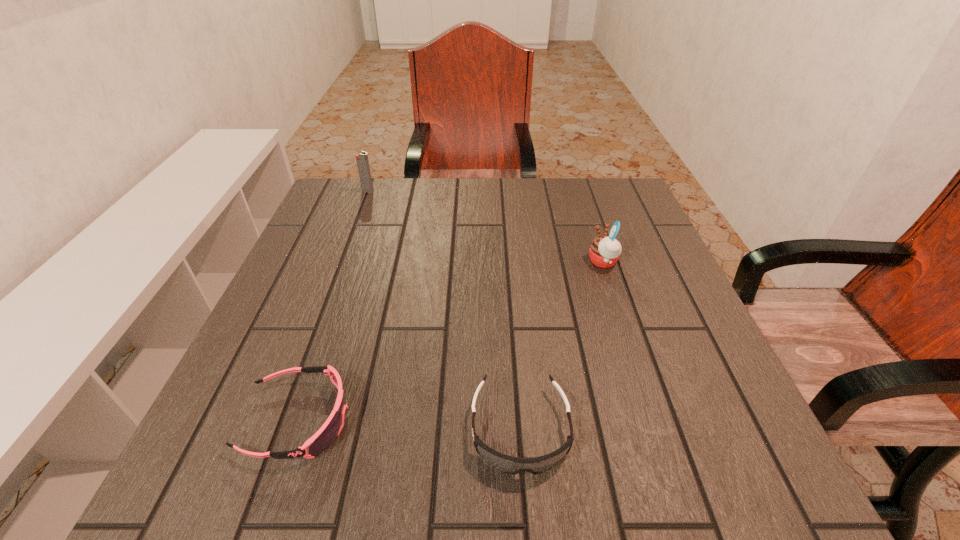
Locate an element on the screen. Image resolution: width=960 pixels, height=540 pixels. free space that is in between the left goggles and the igniter is located at coordinates (333, 305).

This screenshot has width=960, height=540. Find the location of `free point between the muffin and the left goggles`. free point between the muffin and the left goggles is located at coordinates (450, 341).

What are the coordinates of `free space between the second farthest object and the left goggles` in the screenshot? It's located at (450, 341).

This screenshot has width=960, height=540. Identify the location of unoccupied position between the muffin and the left goggles. (450, 341).

Find the location of a particular element. Image resolution: width=960 pixels, height=540 pixels. vacant region between the igniter and the third nearest object is located at coordinates (486, 226).

Locate an element on the screen. This screenshot has height=540, width=960. vacant region between the igniter and the left goggles is located at coordinates (333, 305).

Image resolution: width=960 pixels, height=540 pixels. Identify the location of free point between the right goggles and the igniter. (444, 310).

Locate an element on the screen. blank region between the left goggles and the muffin is located at coordinates (450, 341).

Locate an element on the screen. The image size is (960, 540). free area in between the farthest object and the left goggles is located at coordinates (333, 305).

You are a GUI agent. You are given a task and a screenshot of the screen. Output one action in this format:
    pyautogui.click(x=<x>, y=<y>)
    Task: Click on the free space between the rightmost object and the left goggles
    
    Given the screenshot: What is the action you would take?
    pyautogui.click(x=450, y=341)